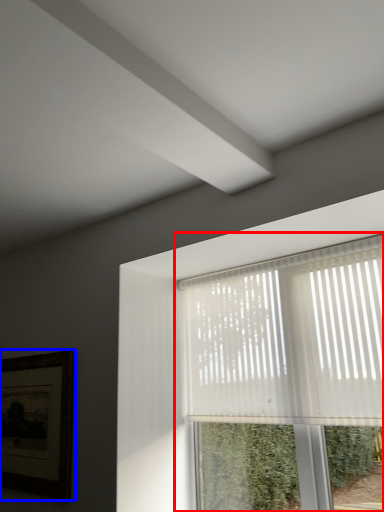
Question: Which point is further to the camera, window (highlighted by a red box) or picture frame (highlighted by a blue box)?

Choices:
 (A) window
 (B) picture frame

Answer: (B)